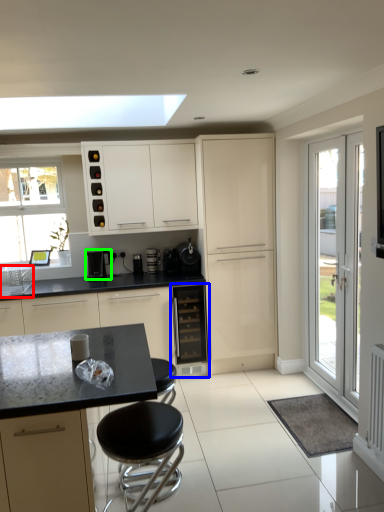
Question: Which object is positioned closest to sink (highlighted by a red box)? Select from oven (highlighted by a blue box) and kitchen appliance (highlighted by a green box).

Choices:
 (A) oven
 (B) kitchen appliance

Answer: (B)